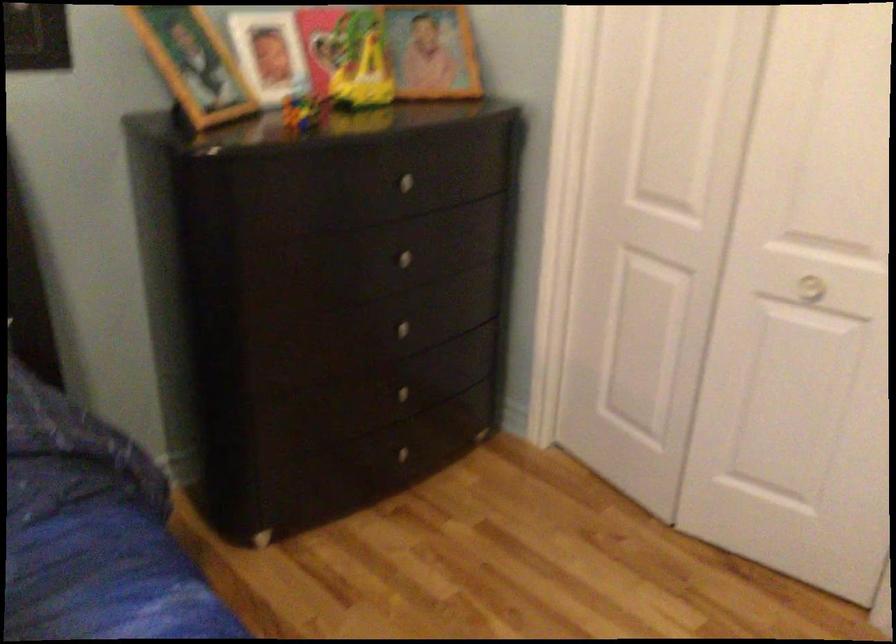
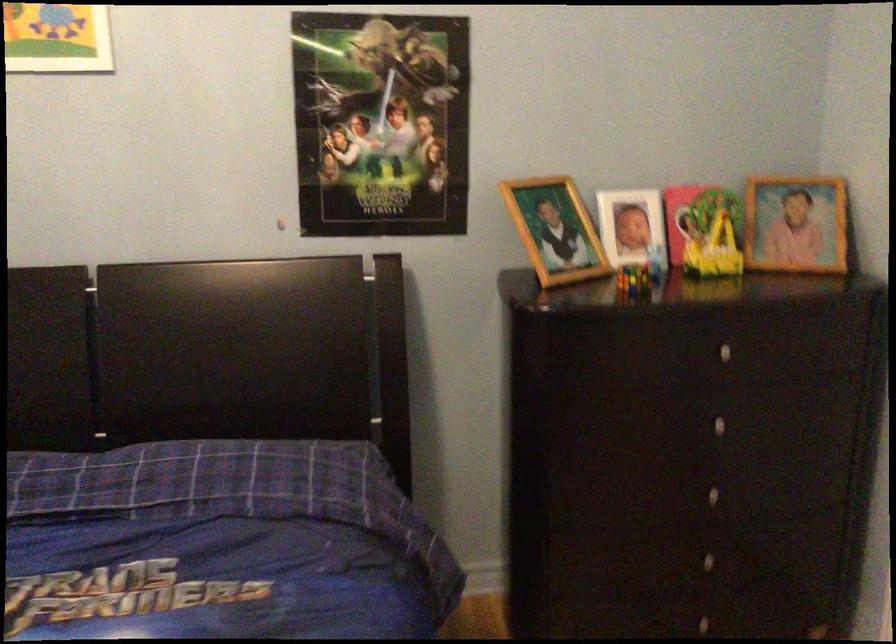
Question: The images are taken continuously from a first-person perspective. In which direction is your viewpoint rotating?

Choices:
 (A) Left
 (B) Right
 (C) Up
 (D) Down

Answer: (A)